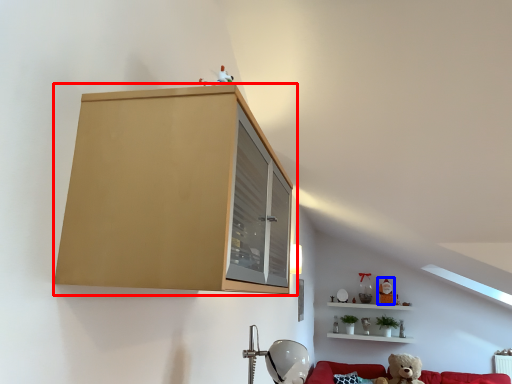
Question: Among these objects, which one is nearest to the camera, cabinetry (highlighted by a red box) or toy (highlighted by a blue box)?

Choices:
 (A) cabinetry
 (B) toy

Answer: (A)